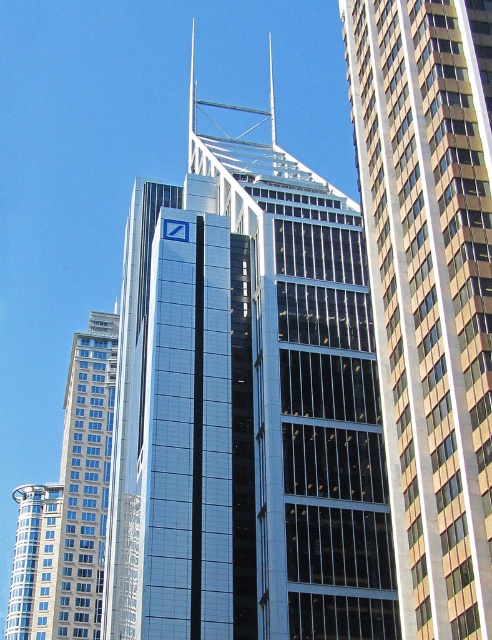
Question: Which object is farther from the camera taking this photo?

Choices:
 (A) silver glass building at left
 (B) shiny glass skyscraper at center

Answer: (A)

Question: Which of the following is the farthest from the observer?

Choices:
 (A) silver glass tower at lower left
 (B) reflective glass skyscraper at right
 (C) shiny glass skyscraper at center

Answer: (A)

Question: Can you confirm if shiny glass skyscraper at center is positioned above silver glass building at left?

Choices:
 (A) yes
 (B) no

Answer: (A)

Question: Which point is closer to the camera?

Choices:
 (A) shiny glass skyscraper at center
 (B) silver glass tower at lower left
 (C) reflective glass skyscraper at right

Answer: (C)

Question: Considering the relative positions of silver glass building at left and silver glass tower at lower left in the image provided, where is silver glass building at left located with respect to silver glass tower at lower left?

Choices:
 (A) left
 (B) right

Answer: (B)

Question: Is shiny glass skyscraper at center below silver glass building at left?

Choices:
 (A) yes
 (B) no

Answer: (B)